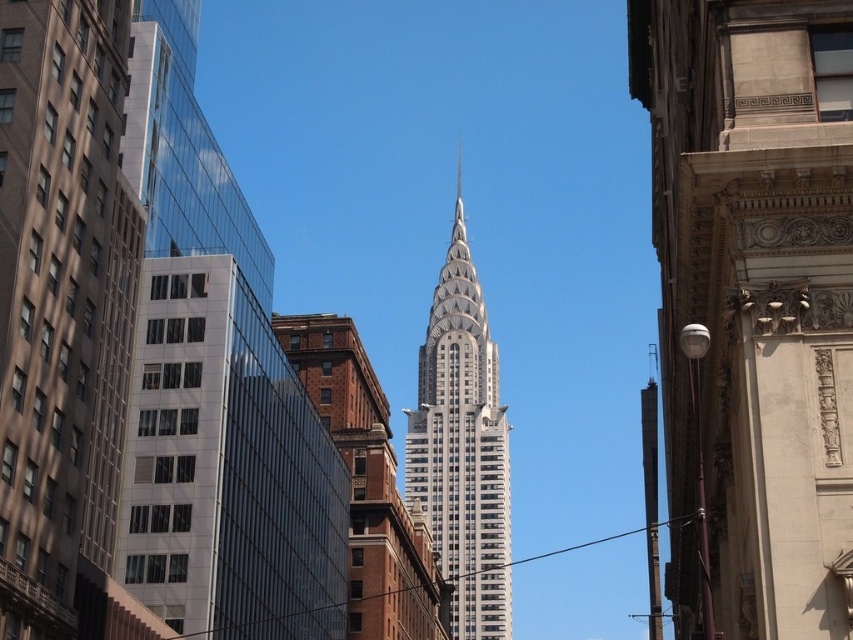
Question: Is glassy reflective skyscraper at left thinner than matte glass building at left?

Choices:
 (A) no
 (B) yes

Answer: (A)

Question: Estimate the real-world distances between objects in this image. Which object is farther from the glassy reflective skyscraper at left?

Choices:
 (A) silver metallic skyscraper at center
 (B) matte glass building at left

Answer: (A)

Question: Considering the relative positions of glassy reflective skyscraper at left and matte glass building at left in the image provided, where is glassy reflective skyscraper at left located with respect to matte glass building at left?

Choices:
 (A) right
 (B) left

Answer: (A)

Question: Which of the following is the closest to the observer?

Choices:
 (A) glassy reflective skyscraper at left
 (B) matte glass building at left
 (C) silver metallic skyscraper at center
 (D) stone/carved facade at center

Answer: (D)

Question: Can you confirm if glassy reflective skyscraper at left is smaller than matte glass building at left?

Choices:
 (A) yes
 (B) no

Answer: (B)

Question: Which point appears closest to the camera in this image?

Choices:
 (A) (135, 404)
 (B) (444, 486)
 (C) (67, 93)
 (D) (843, 604)

Answer: (D)